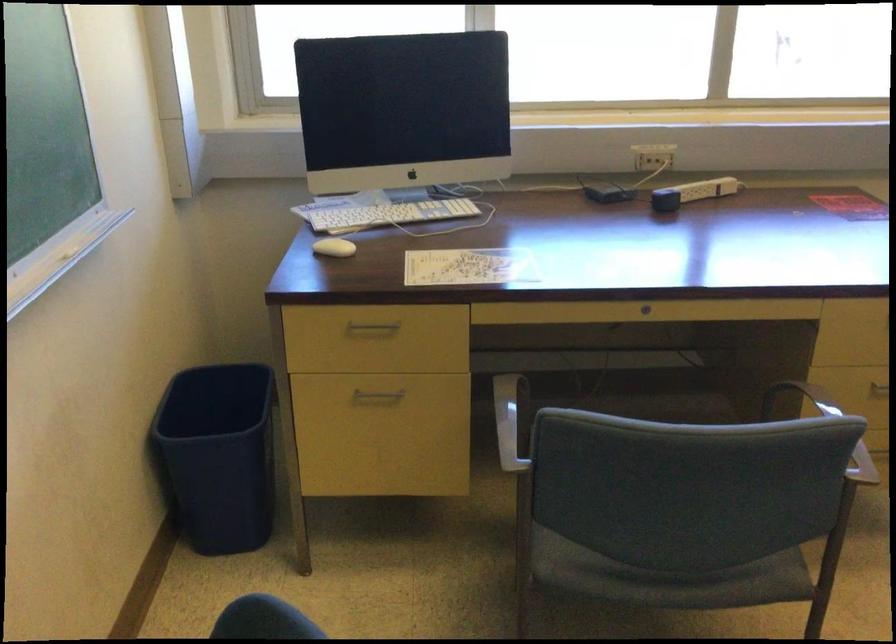
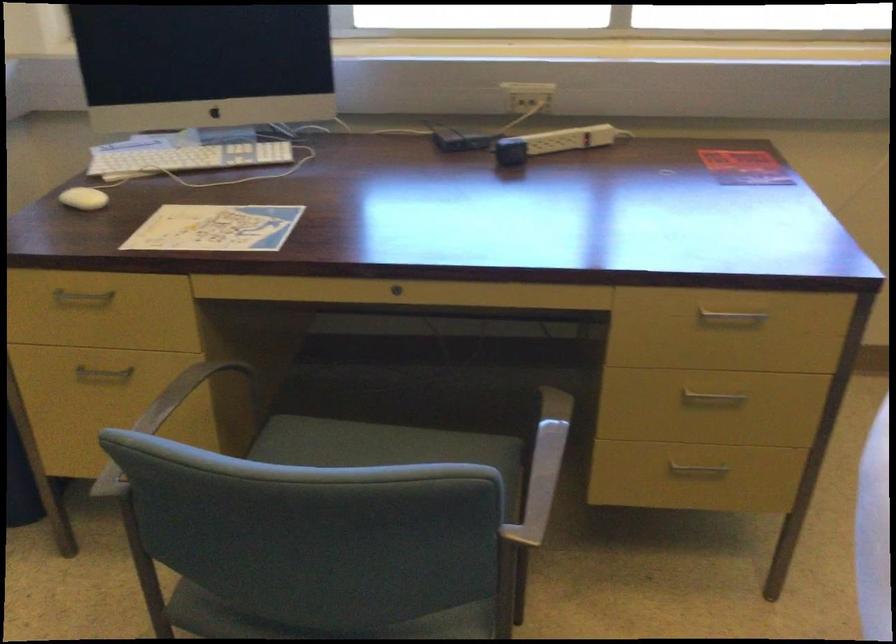
Question: Based on the continuous images, in which direction is the camera rotating? Reply with the corresponding letter.

Choices:
 (A) Left
 (B) Right
 (C) Up
 (D) Down

Answer: (D)